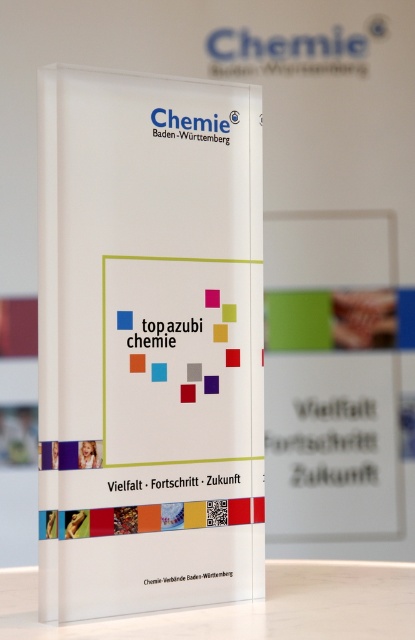
Is white glossy sign at center bigger than transparent acrylic table at lower center?

Correct, white glossy sign at center is larger in size than transparent acrylic table at lower center.

Between white glossy sign at center and transparent acrylic table at lower center, which one has more height?

With more height is white glossy sign at center.

Find the location of a particular element. white glossy sign at center is located at coordinates (148, 342).